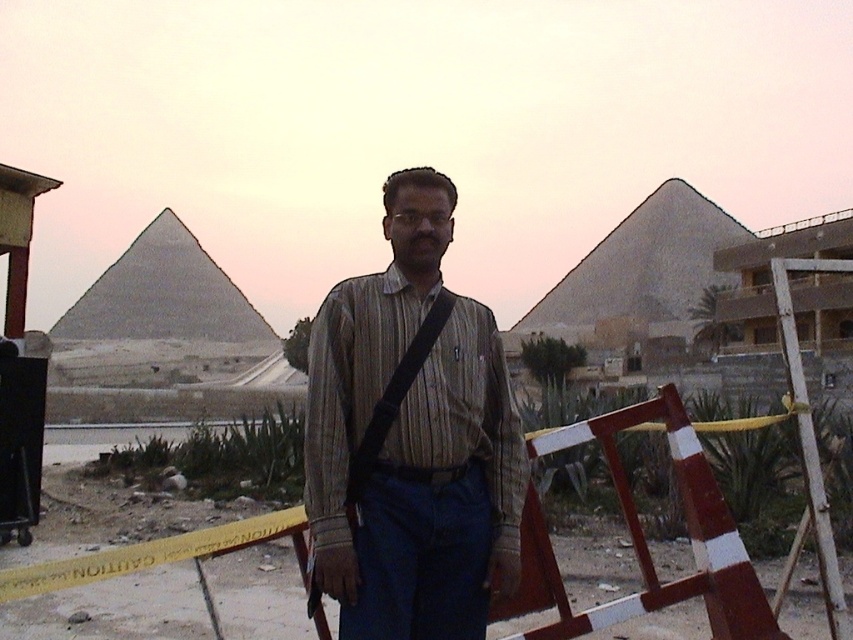
You are a photographer planning to take a photo of the striped cotton shirt at center and the gray stone pyramid at left. Based on their sizes in the image, which object would appear larger in the final photo?

The gray stone pyramid at left would appear larger in the final photo because the striped cotton shirt at center is shorter than it.

You are a tour guide leading a group near the gray stone pyramid at left. You notice the yellow caution tape at center in the distance. Can you confirm if the caution tape is shorter than the pyramid?

The yellow caution tape at center is not as tall as the gray stone pyramid at left, so yes, the caution tape is shorter than the pyramid.